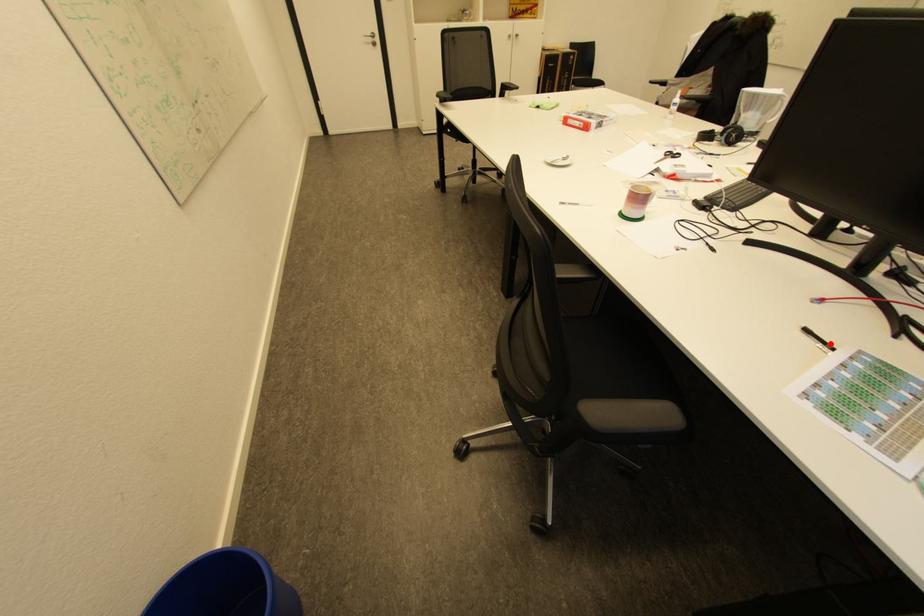
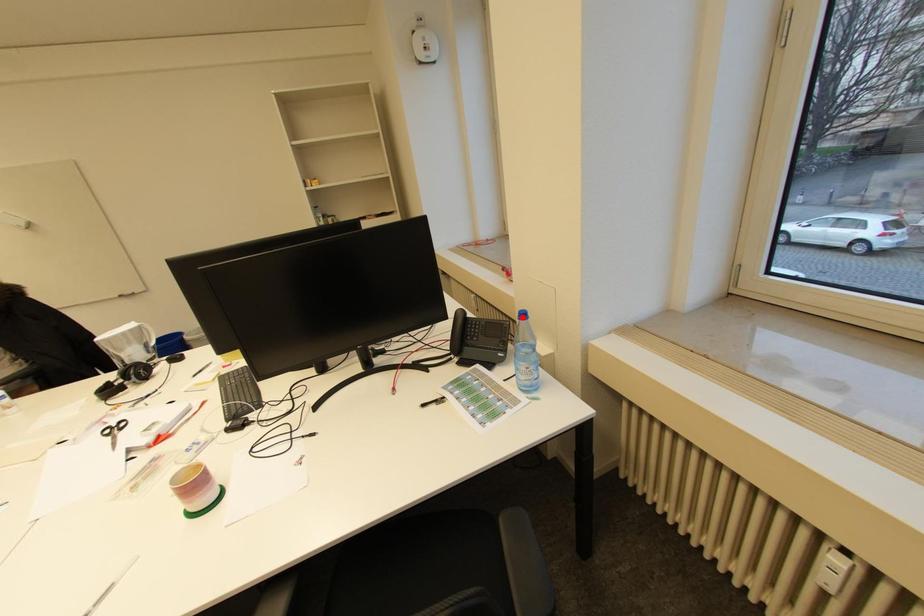
I am providing you with two images of the same scene from different viewpoints. A red point is marked on the first image and another point is marked on the second image. Are the points marked in image1 and image2 representing the same 3D position?

No